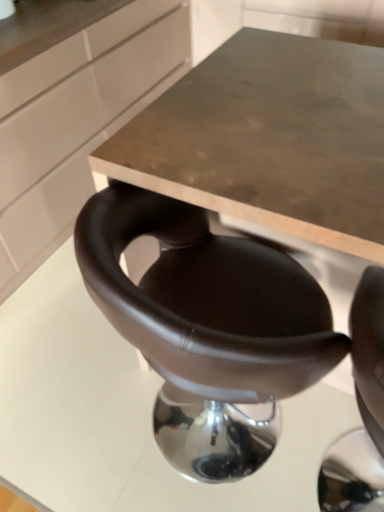
Question: From a real-world perspective, is matte white cabinet at upper left above or below brown leather chair at center?

Choices:
 (A) below
 (B) above

Answer: (B)

Question: Is point (163, 74) closer or farther from the camera than point (213, 377)?

Choices:
 (A) closer
 (B) farther

Answer: (B)

Question: From their relative heights in the image, would you say matte white cabinet at upper left is taller or shorter than brown leather chair at center?

Choices:
 (A) short
 (B) tall

Answer: (B)

Question: Based on their positions, is brown leather chair at center located to the left or right of matte white cabinet at upper left?

Choices:
 (A) left
 (B) right

Answer: (B)

Question: In terms of height, does brown leather chair at center look taller or shorter compared to matte white cabinet at upper left?

Choices:
 (A) short
 (B) tall

Answer: (A)

Question: Would you say brown leather chair at center is inside or outside matte white cabinet at upper left?

Choices:
 (A) inside
 (B) outside

Answer: (B)

Question: In terms of size, does brown leather chair at center appear bigger or smaller than matte white cabinet at upper left?

Choices:
 (A) big
 (B) small

Answer: (B)